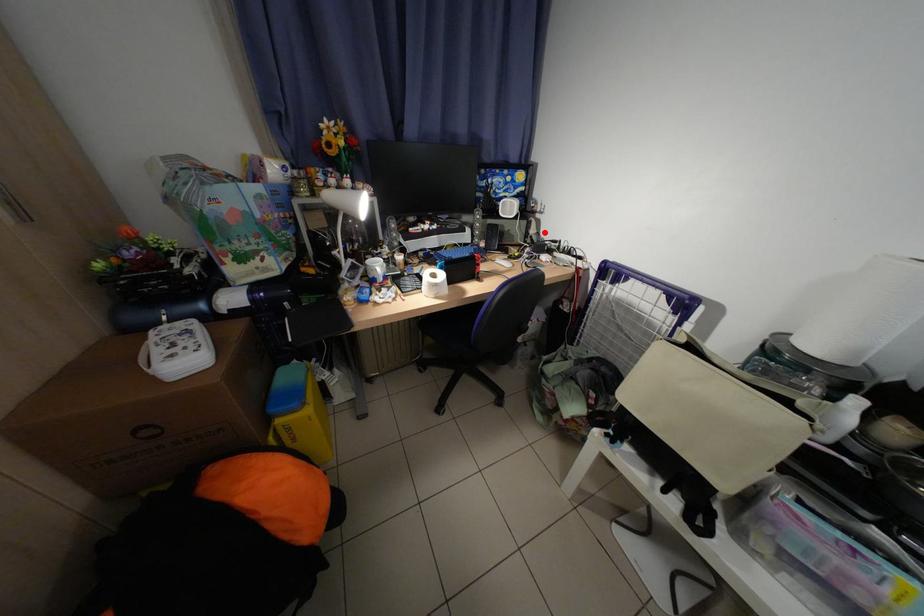
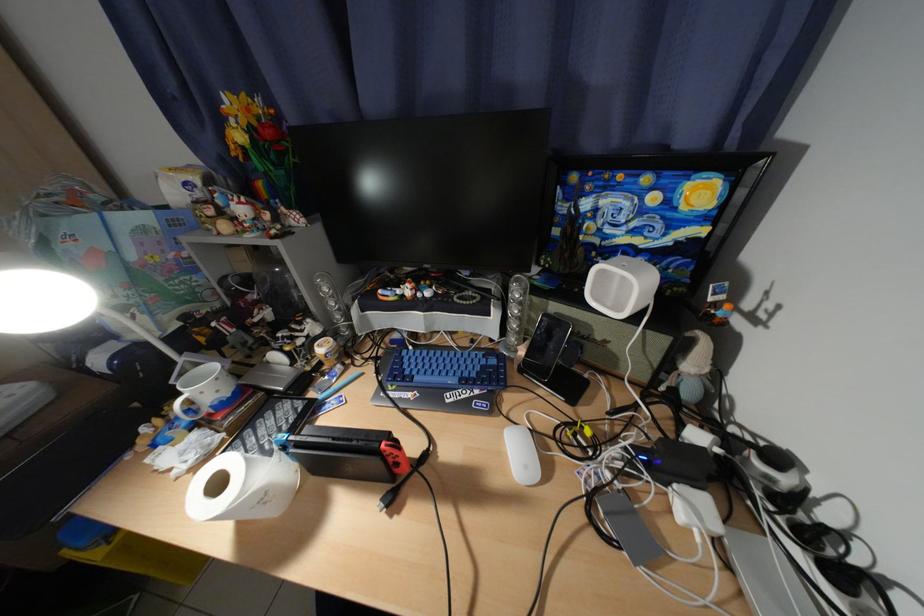
Locate, in the second image, the point that corresponds to the highlighted location in the first image.

(704, 367)